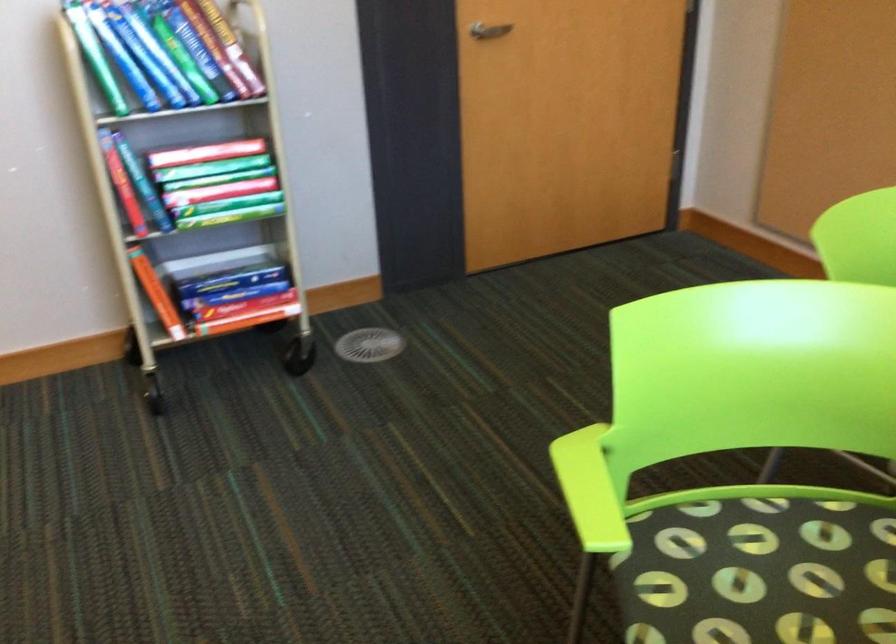
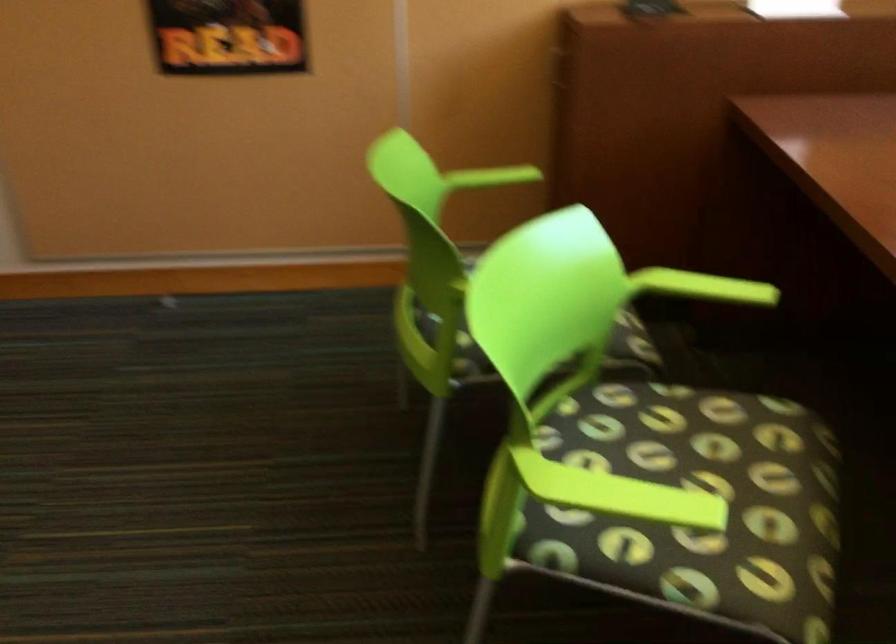
Question: The camera is either moving clockwise (left) or counter-clockwise (right) around the object. The first image is from the beginning of the video and the second image is from the end. Is the camera moving left or right when shooting the video?

Choices:
 (A) Left
 (B) Right

Answer: (A)